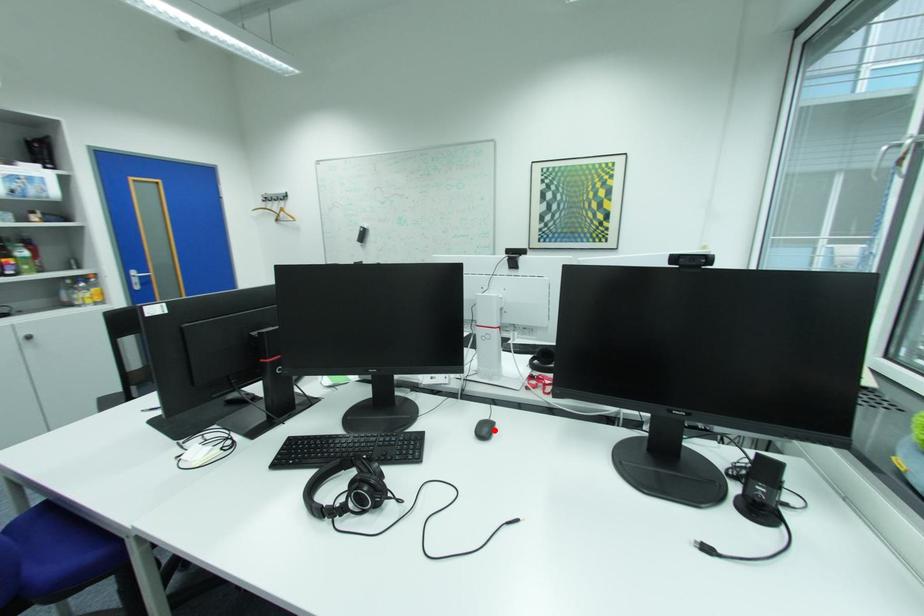
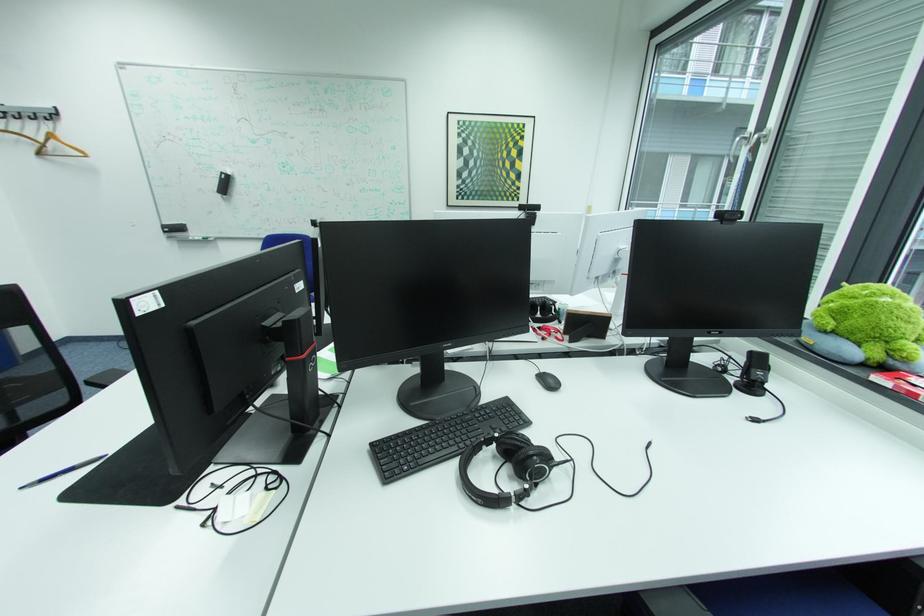
The point at the highlighted location is marked in the first image. Where is the corresponding point in the second image?

(560, 382)